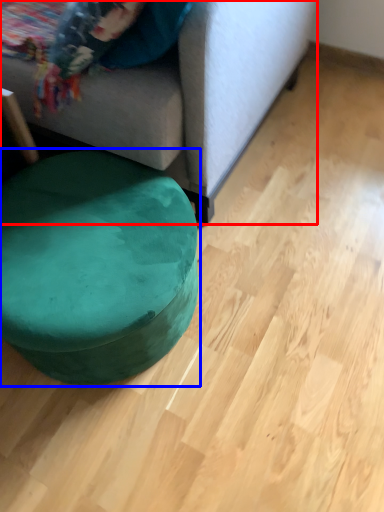
Question: Which point is further to the camera, studio couch (highlighted by a red box) or bean bag chair (highlighted by a blue box)?

Choices:
 (A) studio couch
 (B) bean bag chair

Answer: (B)